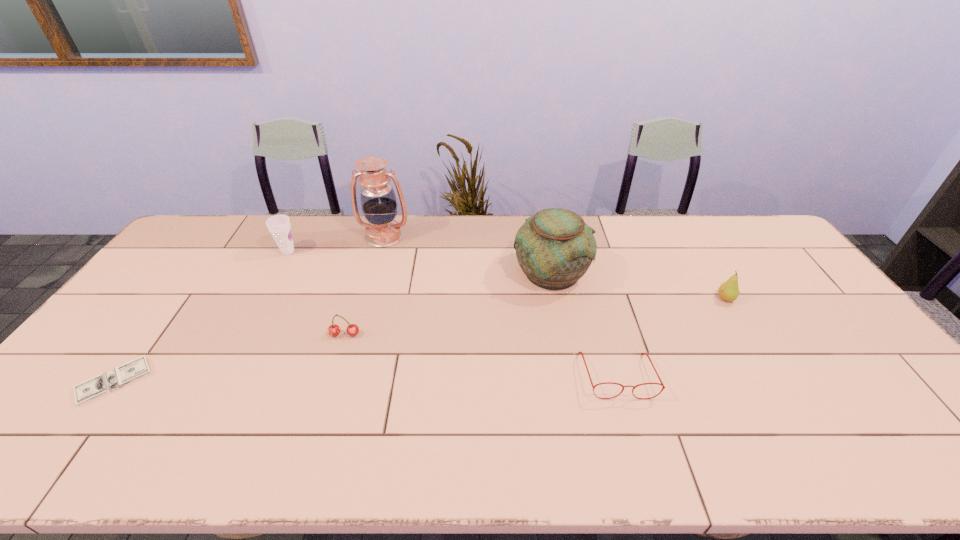
Image resolution: width=960 pixels, height=540 pixels. Identify the location of free location located on the front of the tallest object. (362, 315).

Where is `free space located 0.180m on the front of the sixth shortest object`? free space located 0.180m on the front of the sixth shortest object is located at coordinates (565, 345).

Where is `vacant region located 0.180m on the front of the second object from left to right`? This screenshot has height=540, width=960. vacant region located 0.180m on the front of the second object from left to right is located at coordinates (265, 294).

The image size is (960, 540). Identify the location of vacant region located 0.060m on the left of the pear. (697, 299).

Locate an element on the screen. Image resolution: width=960 pixels, height=540 pixels. free space located 0.280m with stems pointing upwards on the cherry is located at coordinates (315, 433).

The image size is (960, 540). In order to click on vacant area located 0.060m on the face of the spectacles in this screenshot , I will do `click(630, 422)`.

Find the location of a particular element. The width and height of the screenshot is (960, 540). free region located on the right of the leftmost object is located at coordinates (303, 381).

Identify the location of oil lamp at the far edge. (378, 200).

Image resolution: width=960 pixels, height=540 pixels. I want to click on pottery that is at the far edge, so click(554, 248).

Locate an element on the screen. This screenshot has height=540, width=960. cup located at the far edge is located at coordinates (279, 226).